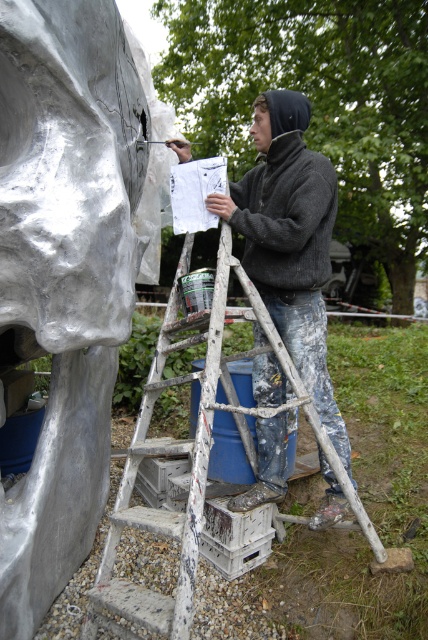
You are an art student observing the scene. You want to take a photo of the sculpture without the ladder blocking it. Based on their positions, can you position yourself so that the white wooden ladder at center is behind the brushed metal sculpture at left in your camera frame?

Yes, since the brushed metal sculpture at left is closer to the viewer than the white wooden ladder at center, positioning yourself so the sculpture is between you and the ladder would block the ladder from view.